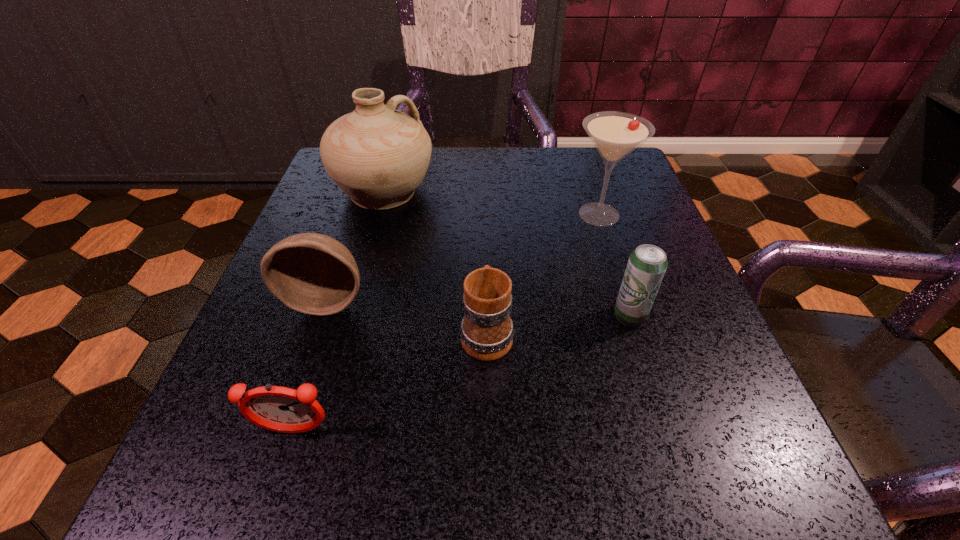
Locate an element on the screen. This screenshot has height=540, width=960. pottery is located at coordinates (378, 156).

The image size is (960, 540). I want to click on martini, so click(615, 134).

I want to click on bowl, so click(311, 273).

Locate an element on the screen. The width and height of the screenshot is (960, 540). beer can is located at coordinates (647, 264).

At what (x,y) coordinates should I click in order to perform the action: click on mug. Please return your answer as a coordinate pair (x, y). The image size is (960, 540). Looking at the image, I should click on (487, 330).

Locate an element on the screen. the nearest object is located at coordinates (281, 409).

The image size is (960, 540). I want to click on the shortest object, so click(281, 409).

Where is `blank space located on the back of the pottery`? blank space located on the back of the pottery is located at coordinates (396, 149).

In order to click on vacant space located 0.310m on the left of the martini in this screenshot , I will do `click(418, 214)`.

Where is `vacant space located on the right of the bowl`? The width and height of the screenshot is (960, 540). vacant space located on the right of the bowl is located at coordinates (437, 300).